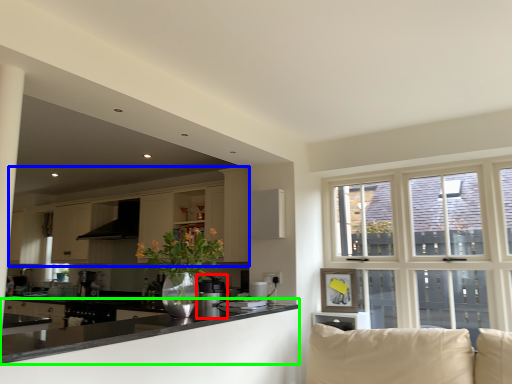
Question: Based on their relative distances, which object is farther from appliance (highlighted by a red box)? Choose from cabinetry (highlighted by a blue box) and countertop (highlighted by a green box).

Choices:
 (A) cabinetry
 (B) countertop

Answer: (A)